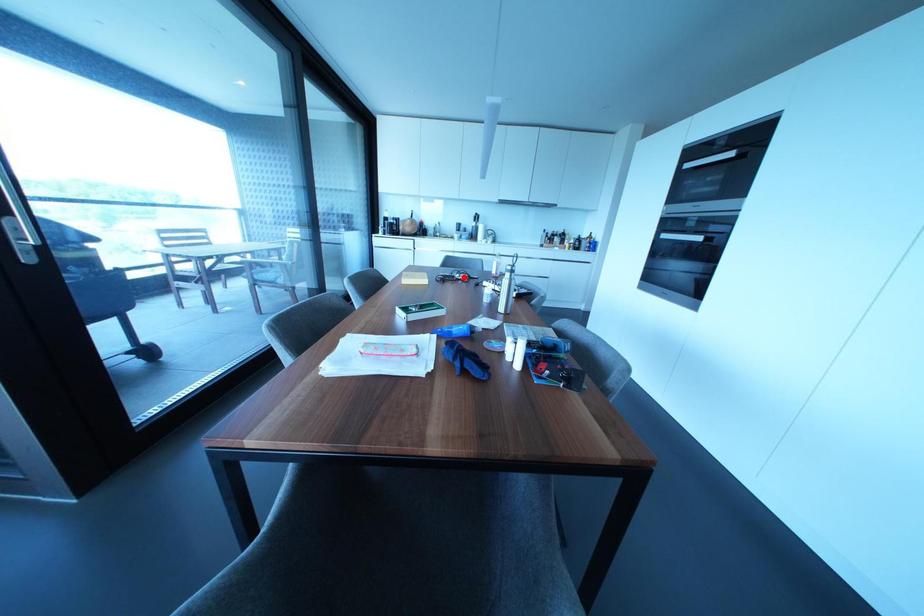
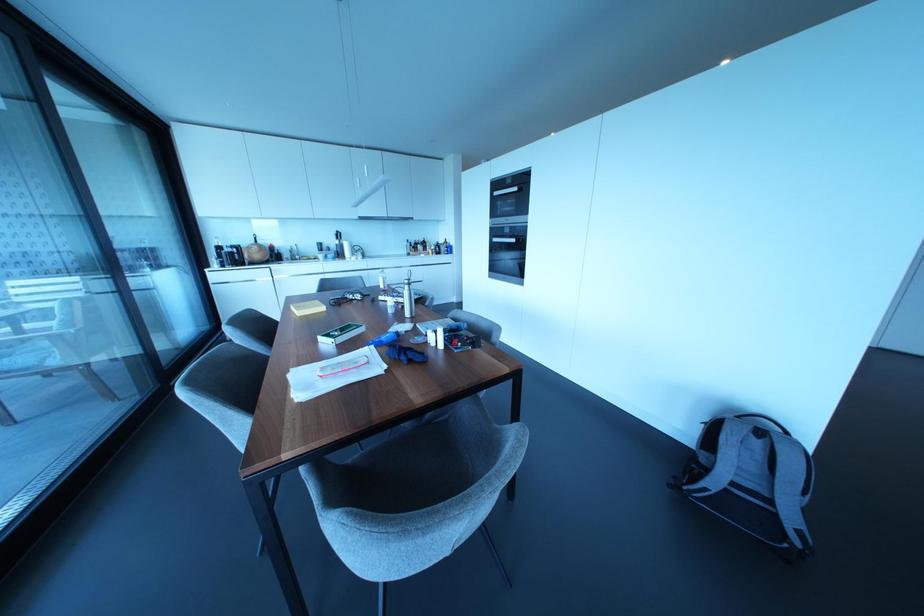
In the second image, find the point that corresponds to the highlighted location in the first image.

(358, 296)